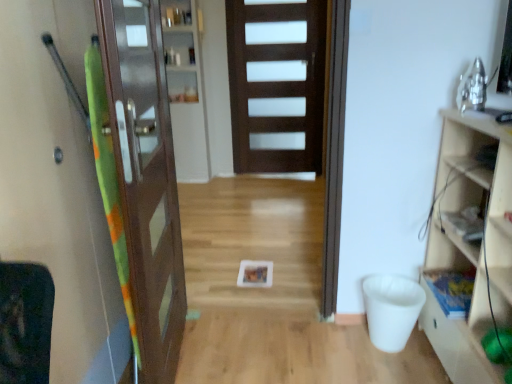
What do you see at coordinates (470, 244) in the screenshot? I see `wooden cabinet at right` at bounding box center [470, 244].

This screenshot has width=512, height=384. Describe the element at coordinates (58, 189) in the screenshot. I see `green fabric screen door at left` at that location.

What are the coordinates of `dark wood door at center, acting as the 1th door starting from the back` in the screenshot? It's located at (277, 84).

Locate an element on the screen. This screenshot has width=512, height=384. wooden cabinet at right is located at coordinates (470, 244).

Between green fabric screen door at left and wooden cabinet at right, which one has more height?

With more height is green fabric screen door at left.

The width and height of the screenshot is (512, 384). I want to click on screen door above the wooden cabinet at right (from the image's perspective), so click(58, 189).

Considering the relative positions of green fabric screen door at left and wooden cabinet at right in the image provided, is green fabric screen door at left to the right of wooden cabinet at right from the viewer's perspective?

In fact, green fabric screen door at left is to the left of wooden cabinet at right.

Is wooden cabinet at right surrounded by green fabric screen door at left?

No, green fabric screen door at left does not contain wooden cabinet at right.

From the image's perspective, which one is positioned higher, wooden cabinet at right or wooden bookshelf at right, the 2th shelf positioned from the left?

wooden cabinet at right appears higher in the image.

Where is `cabinetry above the wooden bookshelf at right, marked as the first shelf in a front-to-back arrangement (from a real-world perspective)`? The width and height of the screenshot is (512, 384). cabinetry above the wooden bookshelf at right, marked as the first shelf in a front-to-back arrangement (from a real-world perspective) is located at coordinates (470, 244).

From the picture: From a real-world perspective, relative to wooden bookshelf at right, the 2th shelf positioned from the left, is wooden cabinet at right vertically above or below?

Clearly, from a real-world perspective, wooden cabinet at right is above wooden bookshelf at right, the 2th shelf positioned from the left.

From the image's perspective, would you say dark wood door at center, acting as the 2th door starting from the left, is shown under wooden cabinet at right?

No, from the image's perspective, dark wood door at center, acting as the 2th door starting from the left, is not below wooden cabinet at right.

Does dark wood door at center, arranged as the first door when viewed from the right, have a larger size compared to wooden cabinet at right?

No, dark wood door at center, arranged as the first door when viewed from the right, is not bigger than wooden cabinet at right.

Who is shorter, dark wood door at center, acting as the 2th door starting from the left, or wooden cabinet at right?

Standing shorter between the two is wooden cabinet at right.

Which is in front, wooden bookshelf at right, placed as the 2th shelf when sorted from back to front, or wooden cabinet at right?

wooden cabinet at right.

The image size is (512, 384). I want to click on shelf below the wooden cabinet at right (from the image's perspective), so 451,291.

From the image's perspective, is wooden bookshelf at right, marked as the first shelf in a front-to-back arrangement, over wooden cabinet at right?

No, from the image's perspective, wooden bookshelf at right, marked as the first shelf in a front-to-back arrangement, is not on top of wooden cabinet at right.

Can you confirm if wooden bookshelf at right, the 2th shelf positioned from the left, is thinner than wooden cabinet at right?

Indeed, wooden bookshelf at right, the 2th shelf positioned from the left, has a lesser width compared to wooden cabinet at right.

Consider the image. From a real-world perspective, is dark wood door at center, acting as the 1th door starting from the back, located beneath green fabric screen door at left?

No, from a real-world perspective, dark wood door at center, acting as the 1th door starting from the back, is not beneath green fabric screen door at left.

Which of these two, dark wood door at center, acting as the 2th door starting from the left, or green fabric screen door at left, is bigger?

Bigger between the two is green fabric screen door at left.

At what (x,y) coordinates should I click in order to perform the action: click on door that is the 2nd object located above the green fabric screen door at left (from the image's perspective). Please return your answer as a coordinate pair (x, y). The width and height of the screenshot is (512, 384). Looking at the image, I should click on (277, 84).

Relative to green fabric screen door at left, is dark wood door at center, acting as the 1th door starting from the back, in front or behind?

dark wood door at center, acting as the 1th door starting from the back, is positioned farther from the viewer than green fabric screen door at left.

Is point (488, 370) positioned in front of point (161, 351)?

Yes.

Looking at this image, considering the relative sizes of wooden cabinet at right and brown wooden door at left, which ranks as the 2th door in right-to-left order, in the image provided, is wooden cabinet at right bigger than brown wooden door at left, which ranks as the 2th door in right-to-left order,?

Yes, wooden cabinet at right is bigger than brown wooden door at left, which ranks as the 2th door in right-to-left order.

Based on the photo, looking at their sizes, would you say wooden cabinet at right is wider or thinner than brown wooden door at left, the first door from the left?

wooden cabinet at right is thinner than brown wooden door at left, the first door from the left.

Is wooden cabinet at right facing away from brown wooden door at left, which ranks as the 1th door in front-to-back order?

wooden cabinet at right is not turned away from brown wooden door at left, which ranks as the 1th door in front-to-back order.

Between point (201, 90) and point (127, 234), which one is positioned in front?

The point (127, 234) is closer to the camera.

Could you tell me if clear glass cabinet at center, positioned as the 1th shelf in top-to-bottom order, is facing brown wooden door at left, the first door from the left?

Yes, clear glass cabinet at center, positioned as the 1th shelf in top-to-bottom order, is oriented towards brown wooden door at left, the first door from the left.

Measure the distance between clear glass cabinet at center, positioned as the 1th shelf in top-to-bottom order, and brown wooden door at left, which ranks as the 2th door in right-to-left order.

clear glass cabinet at center, positioned as the 1th shelf in top-to-bottom order, and brown wooden door at left, which ranks as the 2th door in right-to-left order, are 8.31 feet apart.

You are a GUI agent. You are given a task and a screenshot of the screen. Output one action in this format:
    pyautogui.click(x=<x>, y=<y>)
    Task: Click on the door below the clear glass cabinet at center, which is counted as the 1th shelf, starting from the left (from a real-world perspective)
    
    Given the screenshot: What is the action you would take?
    pyautogui.click(x=145, y=179)

Find the location of `cabinetry below the green fabric screen door at left (from a real-world perspective)`. cabinetry below the green fabric screen door at left (from a real-world perspective) is located at coordinates (470, 244).

Identify the location of cabinetry that appears above the wooden bookshelf at right, arranged as the 1th shelf when ordered from the bottom (from a real-world perspective). (470, 244).

From the image, which object appears to be farther from green fabric screen door at left, dark wood door at center, acting as the 1th door starting from the back, or clear glass cabinet at center, which ranks as the second shelf in front-to-back order?

dark wood door at center, acting as the 1th door starting from the back, is further to green fabric screen door at left.

Which object lies further to the anchor point wooden cabinet at right, brown wooden door at left, the first door from the left, or dark wood door at center, which is the second door from front to back?

dark wood door at center, which is the second door from front to back, lies further to wooden cabinet at right than the other object.

When comparing their distances from green fabric screen door at left, does wooden bookshelf at right, which appears as the second shelf when viewed from the top, or dark wood door at center, arranged as the first door when viewed from the right, seem closer?

Among the two, wooden bookshelf at right, which appears as the second shelf when viewed from the top, is located nearer to green fabric screen door at left.

Looking at the image, which one is located further to green fabric screen door at left, clear glass cabinet at center, arranged as the 1th shelf when viewed from the back, or wooden bookshelf at right, which appears as the second shelf when viewed from the top?

The object further to green fabric screen door at left is clear glass cabinet at center, arranged as the 1th shelf when viewed from the back.

From the image, which object appears to be nearer to dark wood door at center, acting as the 1th door starting from the back, wooden cabinet at right or brown wooden door at left, which ranks as the 2th door in right-to-left order?

brown wooden door at left, which ranks as the 2th door in right-to-left order, is positioned closer to the anchor dark wood door at center, acting as the 1th door starting from the back.

Based on the photo, which object lies further to the anchor point wooden cabinet at right, dark wood door at center, acting as the 1th door starting from the back, or clear glass cabinet at center, which ranks as the 2th shelf in bottom-to-top order?

clear glass cabinet at center, which ranks as the 2th shelf in bottom-to-top order, lies further to wooden cabinet at right than the other object.

Which object lies further to the anchor point green fabric screen door at left, brown wooden door at left, the first door from the left, or dark wood door at center, which is the second door from front to back?

Based on the image, dark wood door at center, which is the second door from front to back, appears to be further to green fabric screen door at left.

Looking at the image, which one is located further to brown wooden door at left, the 2th door in the back-to-front sequence, clear glass cabinet at center, which is the 2th shelf in right-to-left order, or dark wood door at center, acting as the 1th door starting from the back?

The object further to brown wooden door at left, the 2th door in the back-to-front sequence, is dark wood door at center, acting as the 1th door starting from the back.

At what (x,y) coordinates should I click in order to perform the action: click on shelf located between wooden cabinet at right and clear glass cabinet at center, which ranks as the 2th shelf in bottom-to-top order, in the depth direction. Please return your answer as a coordinate pair (x, y). The image size is (512, 384). Looking at the image, I should click on (451, 291).

What are the coordinates of `shelf between brown wooden door at left, the first door from the left, and clear glass cabinet at center, which ranks as the 2th shelf in bottom-to-top order, along the z-axis` in the screenshot? It's located at (451, 291).

Locate an element on the screen. The width and height of the screenshot is (512, 384). shelf positioned between green fabric screen door at left and clear glass cabinet at center, which ranks as the 2th shelf in bottom-to-top order, from near to far is located at coordinates (451, 291).

You are a GUI agent. You are given a task and a screenshot of the screen. Output one action in this format:
    pyautogui.click(x=<x>, y=<y>)
    Task: Click on the cabinetry located between green fabric screen door at left and dark wood door at center, which is the second door from front to back, in the depth direction
    The image size is (512, 384).
    Given the screenshot: What is the action you would take?
    pyautogui.click(x=470, y=244)